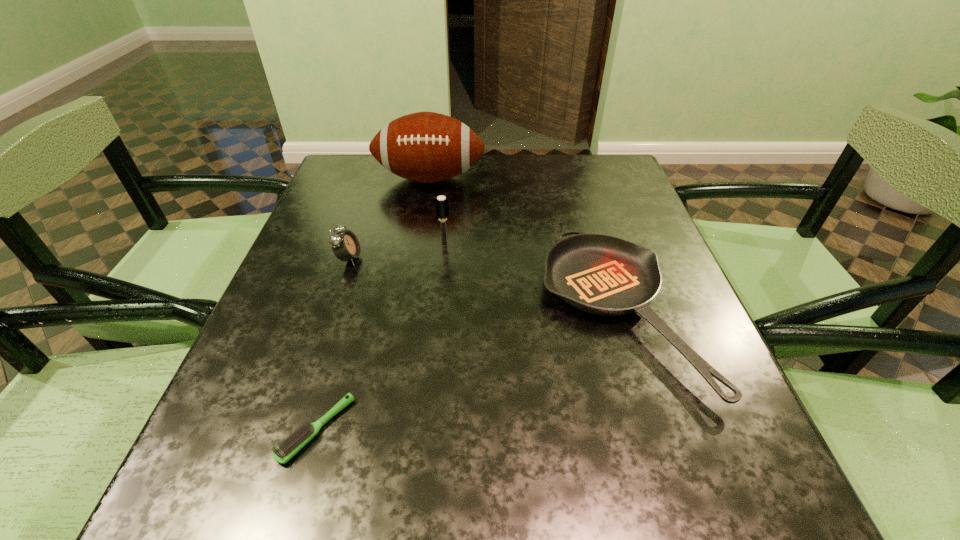
Identify the location of the tallest object. (427, 147).

You are a GUI agent. You are given a task and a screenshot of the screen. Output one action in this format:
    pyautogui.click(x=<x>, y=<y>)
    Task: Click on the football
    The width and height of the screenshot is (960, 540).
    Given the screenshot: What is the action you would take?
    pyautogui.click(x=427, y=147)

At what (x,y) coordinates should I click in order to perform the action: click on the right hairbrush. Please return your answer as a coordinate pair (x, y). Looking at the image, I should click on (442, 207).

Where is `the taller hairbrush`? The image size is (960, 540). the taller hairbrush is located at coordinates (442, 207).

The width and height of the screenshot is (960, 540). Find the location of `the third tallest object`. the third tallest object is located at coordinates (345, 245).

Image resolution: width=960 pixels, height=540 pixels. In order to click on frying pan in this screenshot , I will do `click(600, 274)`.

Locate an element on the screen. This screenshot has height=540, width=960. the second shortest object is located at coordinates (600, 274).

Find the location of a particular element. Image resolution: width=960 pixels, height=540 pixels. the left hairbrush is located at coordinates (297, 440).

Where is `the nearer hairbrush`? This screenshot has width=960, height=540. the nearer hairbrush is located at coordinates (297, 440).

At what (x,y) coordinates should I click in order to perform the action: click on free space located on the laces of the tallest object. Please return your answer as a coordinate pair (x, y). Image resolution: width=960 pixels, height=540 pixels. Looking at the image, I should click on (422, 222).